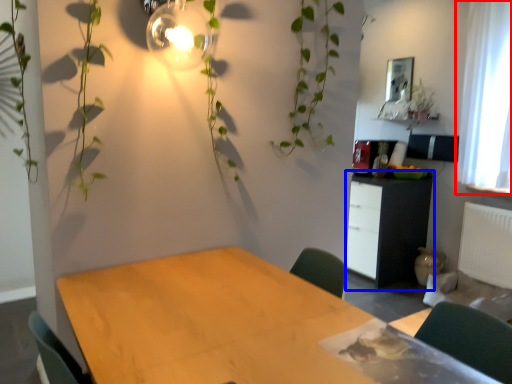
Question: Which of the following is the farthest to the observer, curtain (highlighted by a red box) or cabinetry (highlighted by a blue box)?

Choices:
 (A) curtain
 (B) cabinetry

Answer: (B)